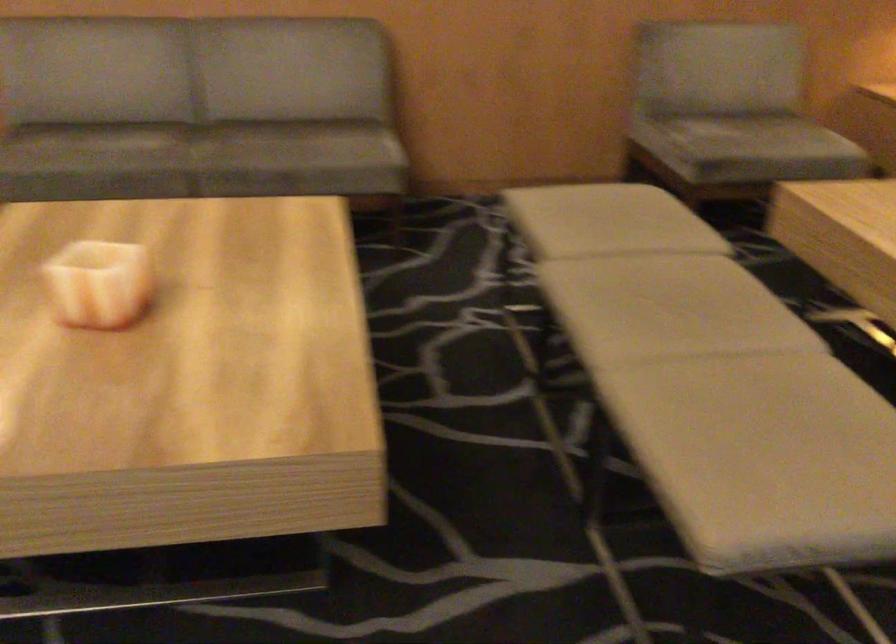
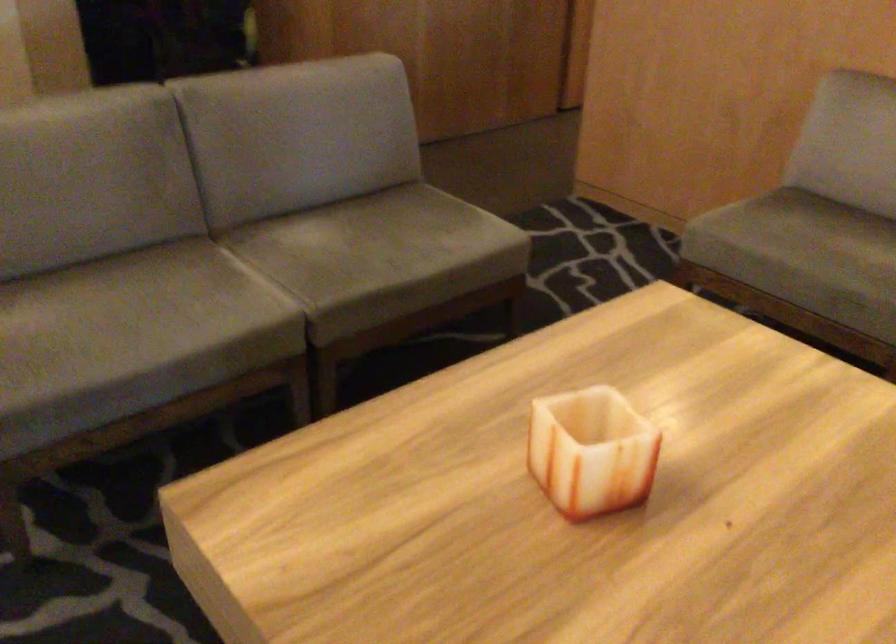
In the second image, find the point that corresponds to pixel 133 266 in the first image.

(590, 451)